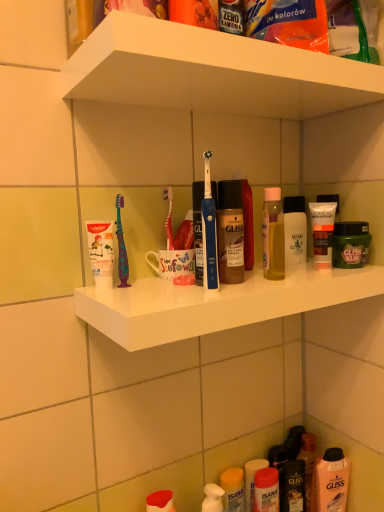
Question: Visually, is green matte hair mask at right, which ranks as the fourth toiletry in left-to-right order, positioned to the left or to the right of matte yellow lotion at lower center, the fourth toiletry when ordered from top to bottom?

Choices:
 (A) right
 (B) left

Answer: (A)

Question: Considering the positions of green matte hair mask at right, which ranks as the fourth toiletry in left-to-right order, and matte yellow lotion at lower center, placed as the 2th toiletry when sorted from left to right, in the image, is green matte hair mask at right, which ranks as the fourth toiletry in left-to-right order, taller or shorter than matte yellow lotion at lower center, placed as the 2th toiletry when sorted from left to right,?

Choices:
 (A) tall
 (B) short

Answer: (B)

Question: Which is nearer to the green matte hair mask at right, marked as the first toiletry in a right-to-left arrangement?

Choices:
 (A) matte yellow lotion at lower center, arranged as the 3th toiletry when viewed from the right
 (B) blue plastic toothbrush at center
 (C) translucent plastic mouthwash at lower right
 (D) white matte toothpaste tube at left, positioned as the 2th toiletry in bottom-to-top order
 (E) white matte tube at right, the fourth toiletry in the bottom-to-top sequence

Answer: (E)

Question: Which object is positioned farthest from the matte yellow lotion at lower center, the first toiletry ordered from the bottom?

Choices:
 (A) white plastic shelf at upper center, the 1th supermarket shelf positioned from the bottom
 (B) white matte tube at right, the fourth toiletry in the bottom-to-top sequence
 (C) white plastic shelf at upper center, which is the first supermarket shelf from top to bottom
 (D) green matte hair mask at right, which is the third toiletry from bottom to top
 (E) translucent plastic mouthwash at lower right

Answer: (C)